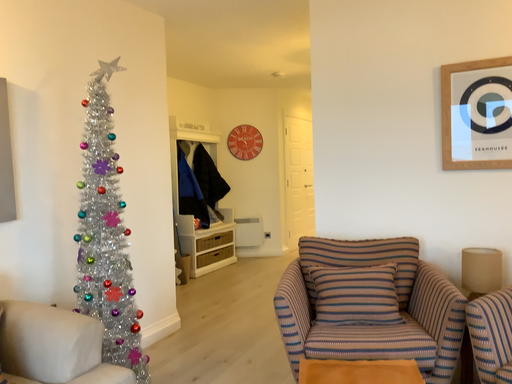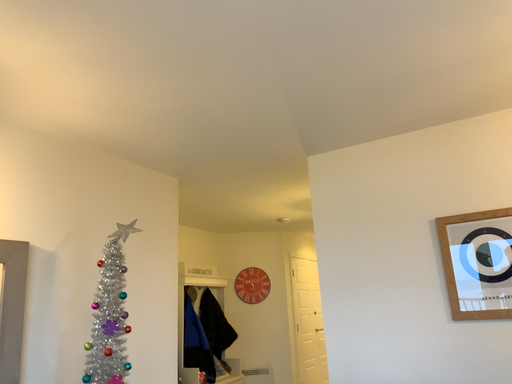
Question: How did the camera likely rotate when shooting the video?

Choices:
 (A) rotated upward
 (B) rotated downward

Answer: (A)